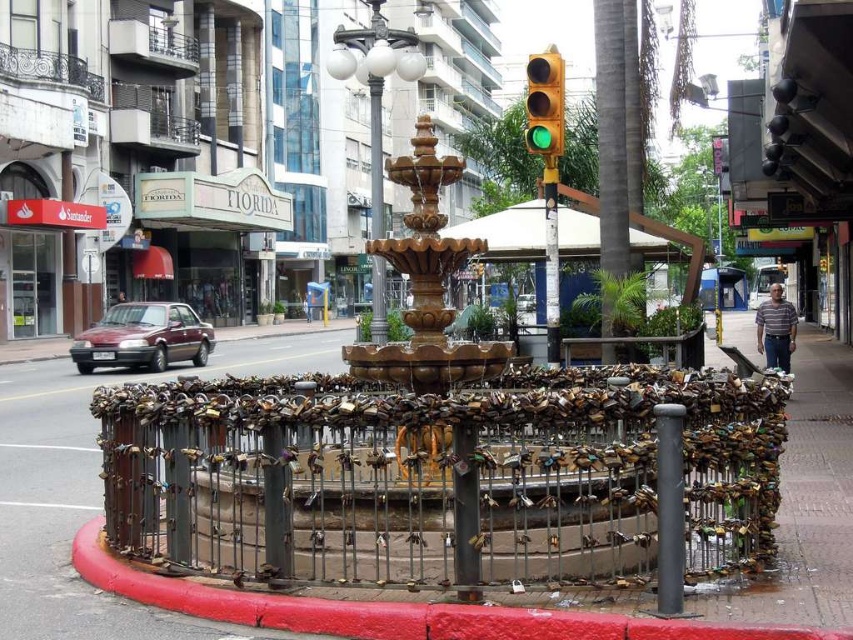
Question: Based on their relative distances, which object is farther from the rusty metal pole at center?

Choices:
 (A) bronze polished pole at center
 (B) bronze/golden metal fountain at center
 (C) metallic pole at center
 (D) smooth painted curb at lower left

Answer: (B)

Question: Can you confirm if smooth painted curb at lower left is wider than bronze/golden metal fountain at center?

Choices:
 (A) yes
 (B) no

Answer: (B)

Question: Is smooth painted curb at lower left positioned behind bronze/golden metal fountain at center?

Choices:
 (A) yes
 (B) no

Answer: (B)

Question: Can you confirm if gold metallic fountain at center is positioned to the left of rusty metal pole at center?

Choices:
 (A) yes
 (B) no

Answer: (A)

Question: Considering the real-world distances, which object is farthest from the metallic pole at center?

Choices:
 (A) bronze/golden metal fountain at center
 (B) metallic gray pole at center
 (C) gold metallic fountain at center
 (D) rusty metal fence at center

Answer: (B)

Question: Which point is closer to the camera taking this photo?

Choices:
 (A) (668, 564)
 (B) (477, 536)
 (C) (381, 150)
 (D) (402, 538)

Answer: (A)